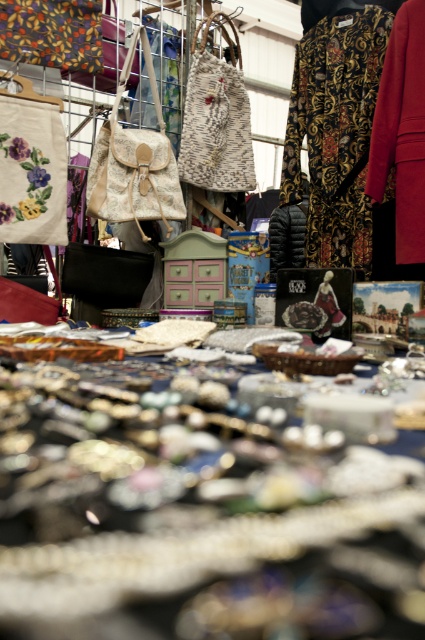
Question: Is velvet red coat at right thinner than matte black puffer jacket at center?

Choices:
 (A) no
 (B) yes

Answer: (B)

Question: Which object appears farthest from the camera in this image?

Choices:
 (A) patterned fabric dress at upper right
 (B) matte black puffer jacket at center
 (C) velvet red coat at right

Answer: (B)

Question: Among these objects, which one is nearest to the camera?

Choices:
 (A) patterned fabric dress at upper right
 (B) matte black puffer jacket at center

Answer: (A)

Question: Which of these objects is positioned farthest from the matte black puffer jacket at center?

Choices:
 (A) patterned fabric dress at upper right
 (B) velvet red coat at right

Answer: (B)

Question: Does velvet red coat at right have a larger size compared to matte black puffer jacket at center?

Choices:
 (A) no
 (B) yes

Answer: (A)

Question: Is velvet red coat at right wider than matte black puffer jacket at center?

Choices:
 (A) yes
 (B) no

Answer: (B)